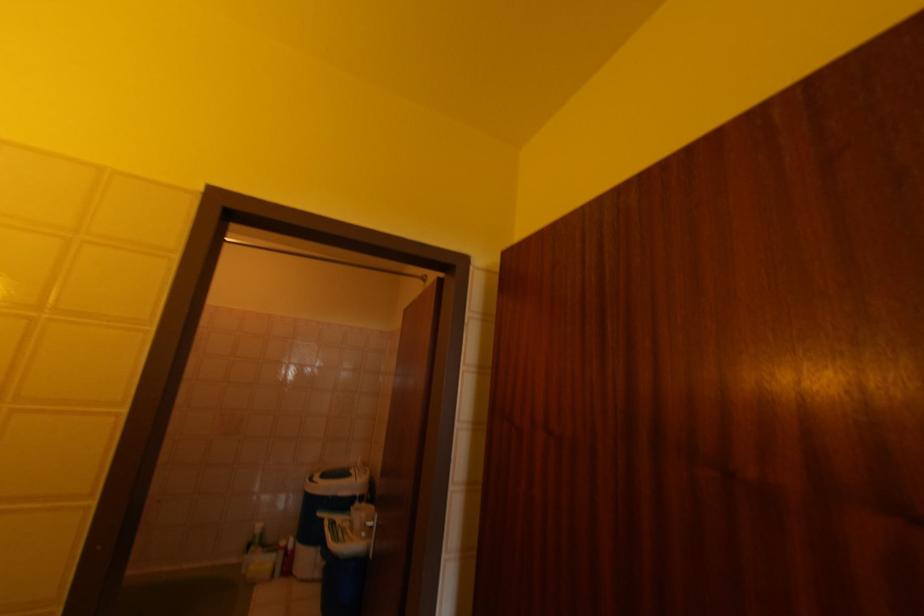
What do you see at coordinates (338, 480) in the screenshot? Image resolution: width=924 pixels, height=616 pixels. I see `the portable washer lid` at bounding box center [338, 480].